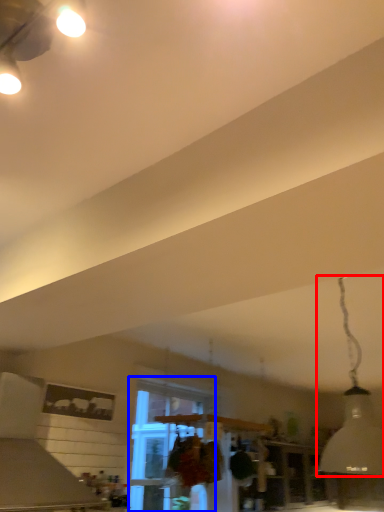
Question: Which object is further to the camera taking this photo, lamp (highlighted by a red box) or window (highlighted by a blue box)?

Choices:
 (A) lamp
 (B) window

Answer: (B)